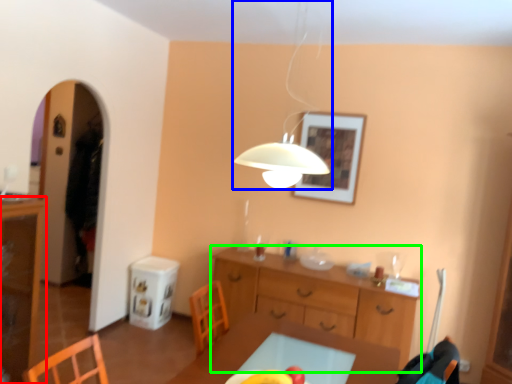
Question: Based on their relative distances, which object is farther from cabinetry (highlighted by a red box)? Choose from lamp (highlighted by a blue box) and desk (highlighted by a green box).

Choices:
 (A) lamp
 (B) desk

Answer: (A)